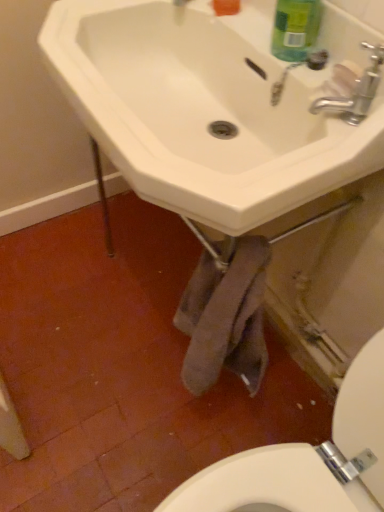
Question: From the image's perspective, is silver metallic faucet at upper right beneath white ceramic sink at center?

Choices:
 (A) no
 (B) yes

Answer: (B)

Question: Can you confirm if silver metallic faucet at upper right is taller than white ceramic sink at center?

Choices:
 (A) yes
 (B) no

Answer: (B)

Question: Would you say silver metallic faucet at upper right is outside white ceramic sink at center?

Choices:
 (A) no
 (B) yes

Answer: (A)

Question: Is silver metallic faucet at upper right smaller than white ceramic sink at center?

Choices:
 (A) no
 (B) yes

Answer: (B)

Question: From a real-world perspective, is silver metallic faucet at upper right beneath white ceramic sink at center?

Choices:
 (A) yes
 (B) no

Answer: (B)

Question: Is white ceramic sink at center bigger or smaller than green matte bottle at upper right?

Choices:
 (A) small
 (B) big

Answer: (B)

Question: Does point coord(278,160) appear closer or farther from the camera than point coord(286,49)?

Choices:
 (A) farther
 (B) closer

Answer: (B)

Question: Is white ceramic sink at center in front of or behind green matte bottle at upper right in the image?

Choices:
 (A) front
 (B) behind

Answer: (A)

Question: From a real-world perspective, is white ceramic sink at center positioned above or below green matte bottle at upper right?

Choices:
 (A) below
 (B) above

Answer: (A)

Question: From the image's perspective, is green matte bottle at upper right positioned above or below silver metallic faucet at upper right?

Choices:
 (A) above
 (B) below

Answer: (A)

Question: Is point (299, 41) closer or farther from the camera than point (382, 58)?

Choices:
 (A) closer
 (B) farther

Answer: (B)

Question: From a real-world perspective, is green matte bottle at upper right positioned above or below silver metallic faucet at upper right?

Choices:
 (A) below
 (B) above

Answer: (B)

Question: Looking at the image, does green matte bottle at upper right seem bigger or smaller compared to silver metallic faucet at upper right?

Choices:
 (A) big
 (B) small

Answer: (B)

Question: Visually, is white ceramic sink at center positioned to the left or to the right of silver metallic faucet at upper right?

Choices:
 (A) left
 (B) right

Answer: (A)

Question: From the image's perspective, is white ceramic sink at center positioned above or below silver metallic faucet at upper right?

Choices:
 (A) below
 (B) above

Answer: (B)